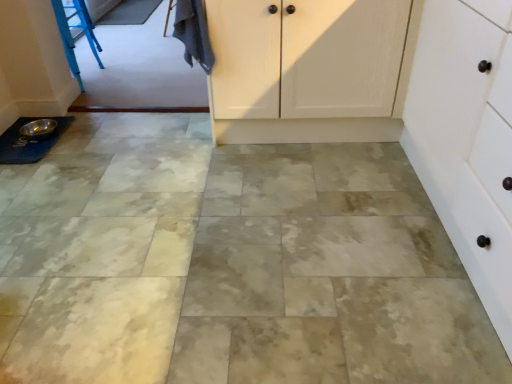
Locate an element on the screen. This screenshot has height=384, width=512. blank space above silver metallic bowl at lower left (from a real-world perspective) is located at coordinates (38, 124).